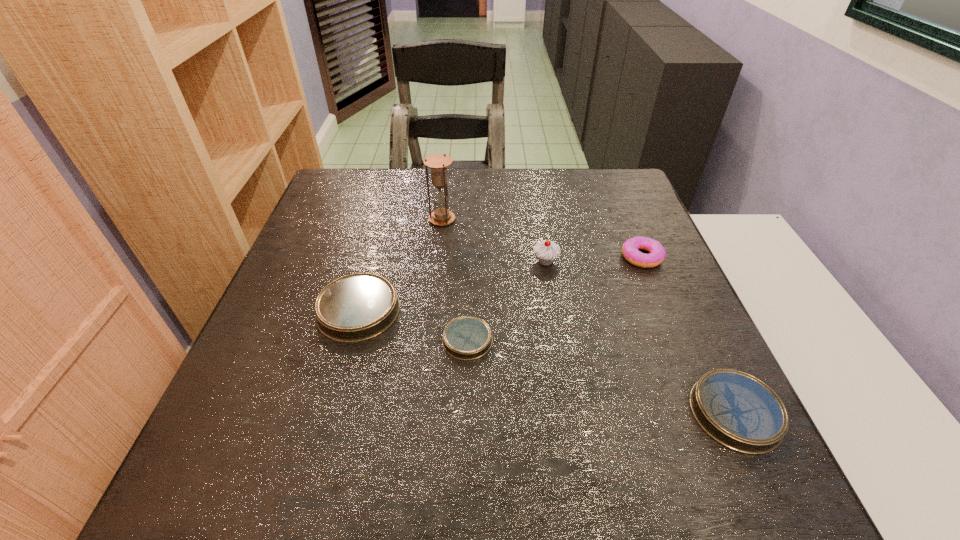
Where is `spot to insert another compass for uniform distribution`? spot to insert another compass for uniform distribution is located at coordinates (591, 374).